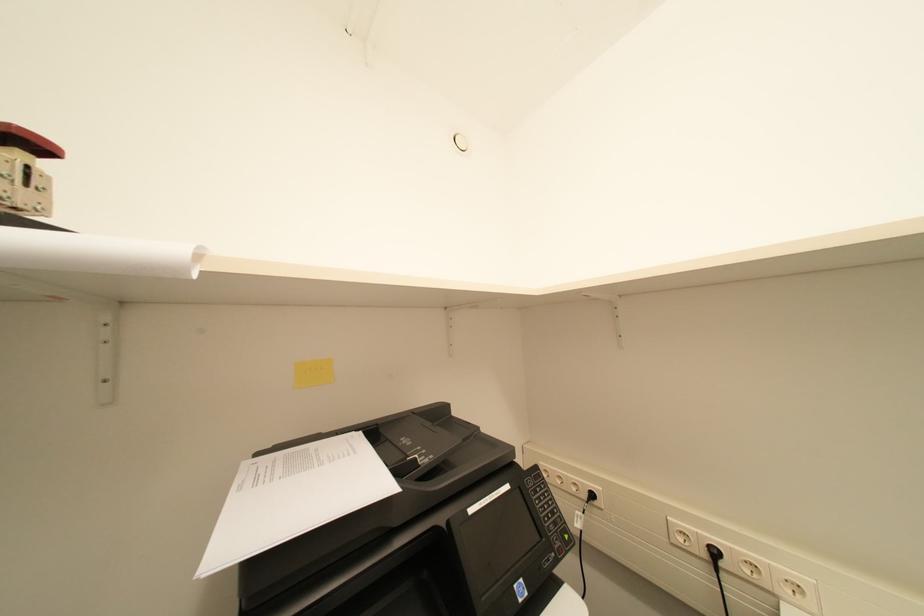
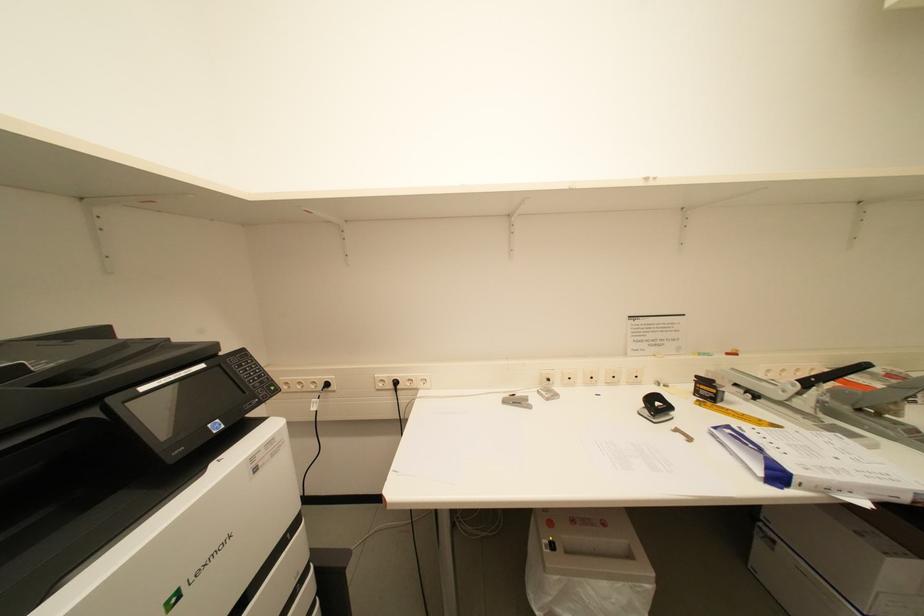
Question: Based on the continuous images, in which direction is the camera rotating? Reply with the corresponding letter.

Choices:
 (A) Left
 (B) Right
 (C) Up
 (D) Down

Answer: (B)